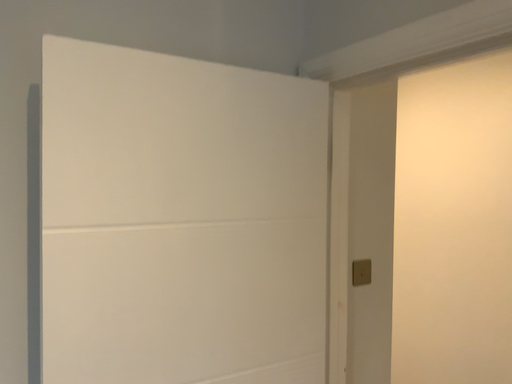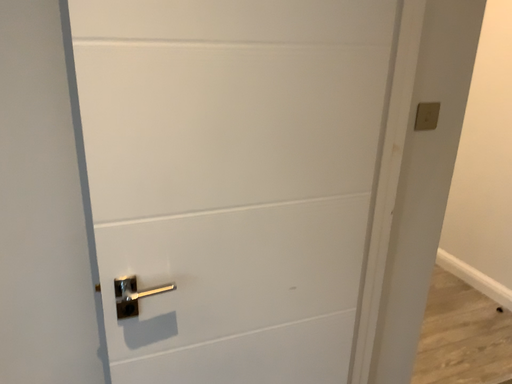
Question: How did the camera likely rotate when shooting the video?

Choices:
 (A) rotated left
 (B) rotated right

Answer: (A)